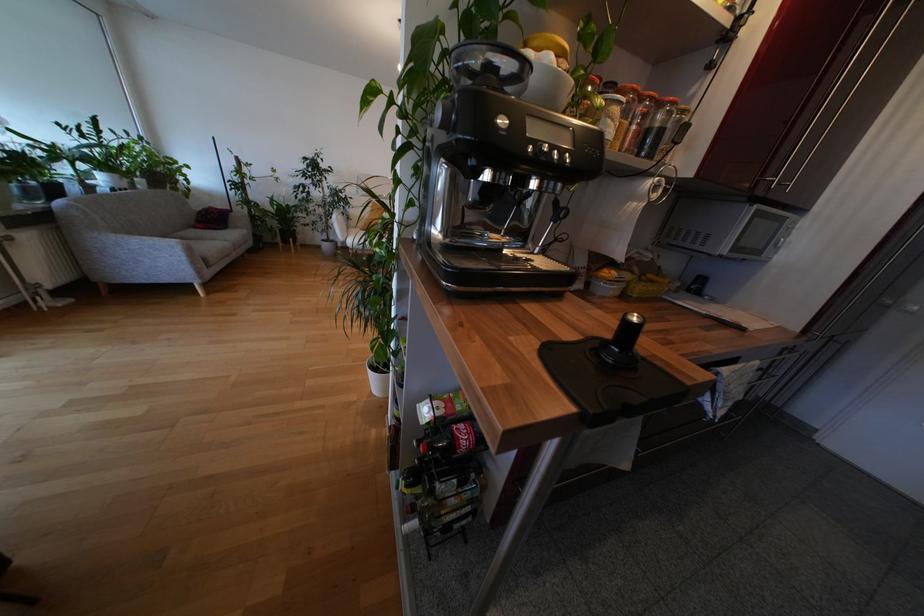
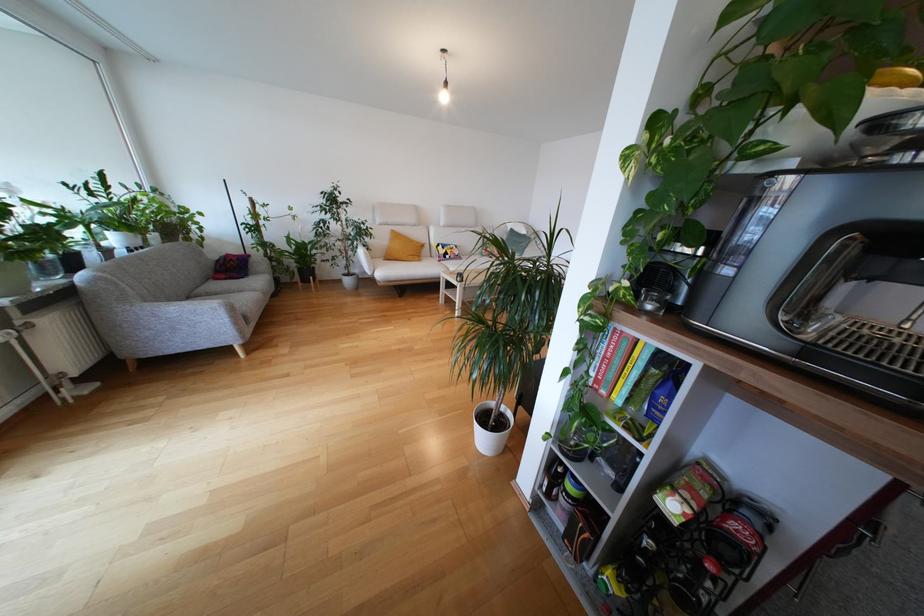
Locate, in the second image, the point that corresponds to (x=234, y=223) in the first image.

(253, 268)